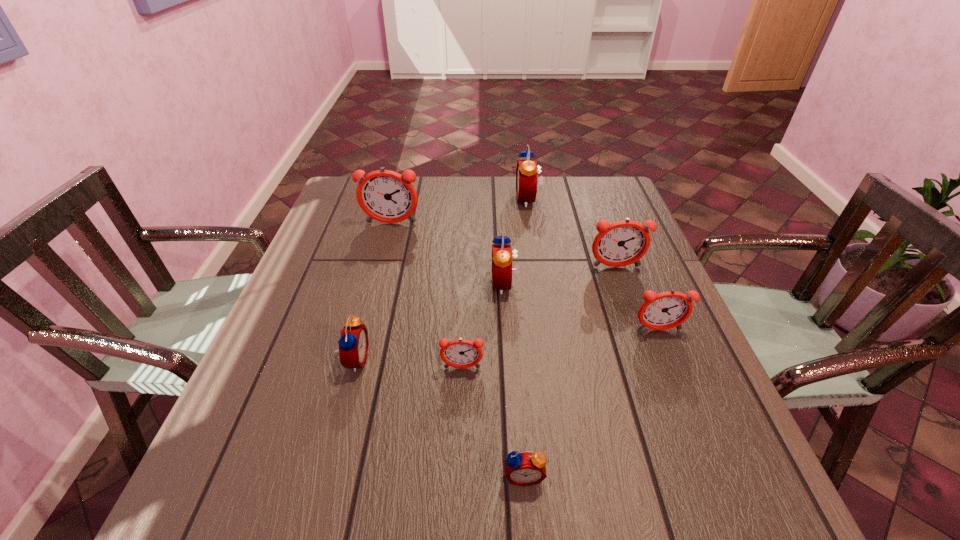
The height and width of the screenshot is (540, 960). I want to click on free spot between the leftmost red alarm clock and the smallest red alarm clock, so click(440, 417).

This screenshot has height=540, width=960. In order to click on free space between the nearest reddish-pink alarm clock and the leftmost red alarm clock in this screenshot , I will do `click(409, 364)`.

Image resolution: width=960 pixels, height=540 pixels. What are the coordinates of `free spot between the sixth object from right to left and the nearest red alarm clock` in the screenshot? It's located at (492, 422).

The width and height of the screenshot is (960, 540). Identify the location of the sixth closest object relative to the fifth farthest object. (353, 343).

Locate an element on the screen. object that is the seventh closest to the leftmost reddish-pink alarm clock is located at coordinates (525, 468).

This screenshot has width=960, height=540. What are the coordinates of `alarm clock that is the closest to the third smallest reddish-pink alarm clock` in the screenshot? It's located at (502, 257).

Locate an element on the screen. alarm clock that stands as the closest to the biggest reddish-pink alarm clock is located at coordinates (502, 257).

Identify the location of the fourth closest red alarm clock to the fourth nearest alarm clock. The height and width of the screenshot is (540, 960). [x=353, y=343].

Image resolution: width=960 pixels, height=540 pixels. What are the coordinates of `red alarm clock object that ranks as the closest to the nearest alarm clock` in the screenshot? It's located at point(353,343).

Identify which reddish-pink alarm clock is located as the fourth nearest to the farthest object. Please provide its 2D coordinates. Your answer should be formatted as a tuple, i.e. [(x, y)], where the tuple contains the x and y coordinates of a point satisfying the conditions above.

[(460, 353)]